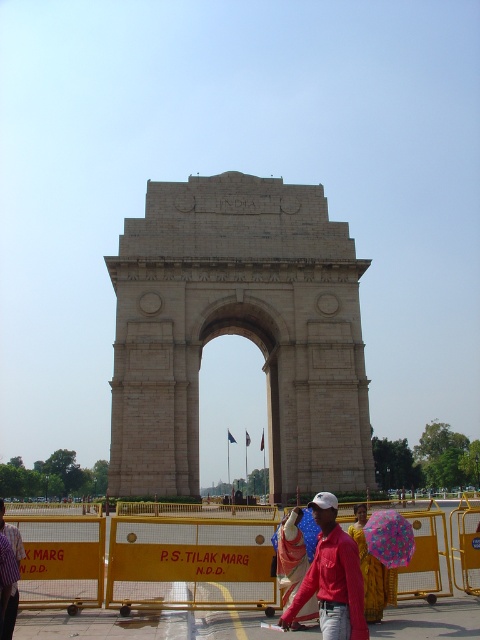
Can you confirm if multicolored fabric umbrella at center is shorter than striped fabric shirt at lower left?

Indeed, multicolored fabric umbrella at center has a lesser height compared to striped fabric shirt at lower left.

Does multicolored fabric umbrella at center have a lesser width compared to striped fabric shirt at lower left?

In fact, multicolored fabric umbrella at center might be wider than striped fabric shirt at lower left.

Is point (379, 518) closer to camera compared to point (14, 536)?

No.

Identify the location of multicolored fabric umbrella at center. (389, 538).

Is red fabric umbrella at center to the left of striped fabric shirt at lower left from the viewer's perspective?

In fact, red fabric umbrella at center is to the right of striped fabric shirt at lower left.

Who is more forward, (290, 586) or (8, 538)?

Positioned in front is point (290, 586).

Image resolution: width=480 pixels, height=640 pixels. What are the coordinates of `red fabric umbrella at center` in the screenshot? It's located at (290, 554).

Describe the element at coordinates (238, 332) in the screenshot. This screenshot has height=640, width=480. I see `beige stone arch at center` at that location.

Can you confirm if beige stone arch at center is thinner than striped fabric shirt at lower left?

No.

Locate an element on the screen. beige stone arch at center is located at coordinates (x=238, y=332).